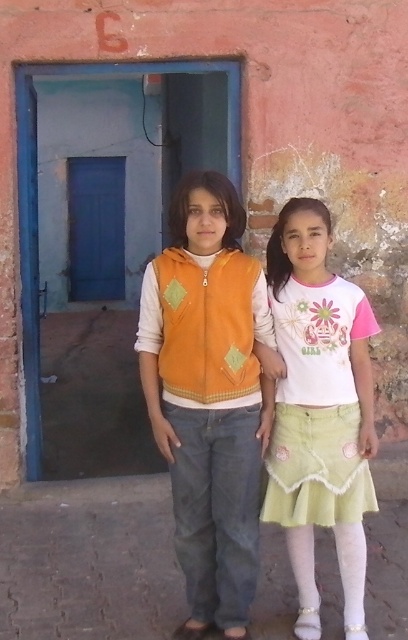
Question: Considering the relative positions of orange fleece vest at center and white cotton shirt at center in the image provided, where is orange fleece vest at center located with respect to white cotton shirt at center?

Choices:
 (A) above
 (B) below

Answer: (A)

Question: Is orange fleece vest at center below white cotton shirt at center?

Choices:
 (A) no
 (B) yes

Answer: (A)

Question: Observing the image, what is the correct spatial positioning of orange fleece vest at center in reference to white cotton shirt at center?

Choices:
 (A) above
 (B) below

Answer: (A)